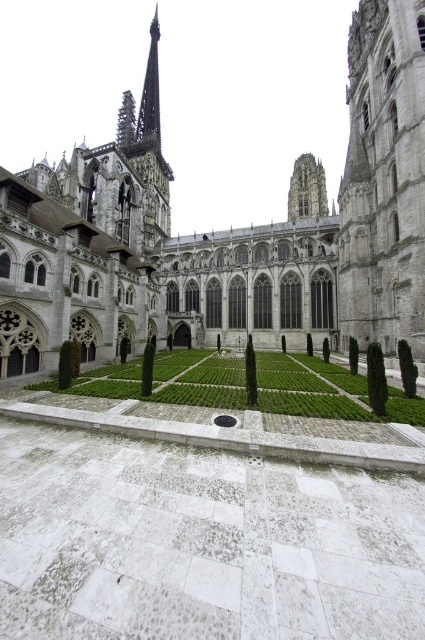
You are standing in front of the cathedral and want to walk towards the green grass at center and the white stone courtyard at center. Which one is located to your right?

The green grass at center is positioned on the right side of the white stone courtyard at center, so it is located to your right.

You are a gardener who needs to mow the lawn. You see the green grass at center and the white stone courtyard at center in the cathedral area. Which area requires mowing?

The green grass at center requires mowing because it is much taller than the white stone courtyard at center.